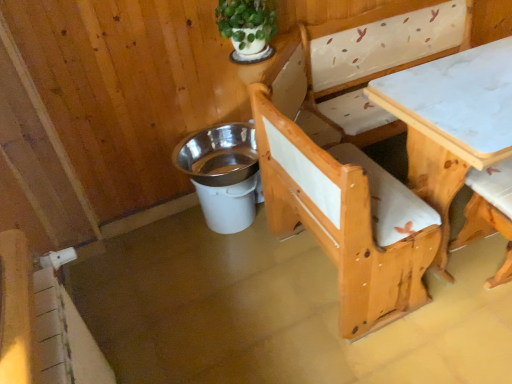
Question: Is white plastic bucket at lower center in front of or behind green matte plant at upper center in the image?

Choices:
 (A) front
 (B) behind

Answer: (B)

Question: From their relative heights in the image, would you say white plastic bucket at lower center is taller or shorter than green matte plant at upper center?

Choices:
 (A) short
 (B) tall

Answer: (B)

Question: Which is nearer to the white marble table at center?

Choices:
 (A) white plastic bucket at lower center
 (B) green matte plant at upper center
 (C) wooden chair at lower right

Answer: (C)

Question: Which of these objects is positioned closest to the white plastic bucket at lower center?

Choices:
 (A) green matte plant at upper center
 (B) wooden chair at lower right
 (C) white marble table at center

Answer: (A)